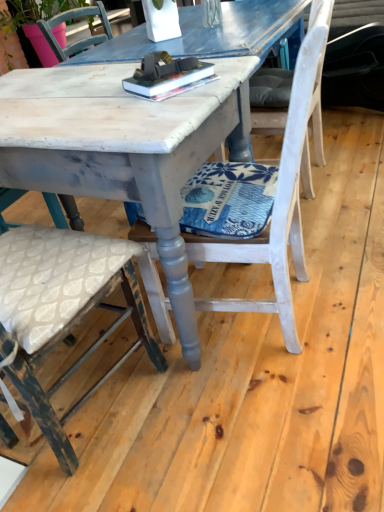
In order to click on free space in front of hardcover book at center in this screenshot , I will do `click(167, 108)`.